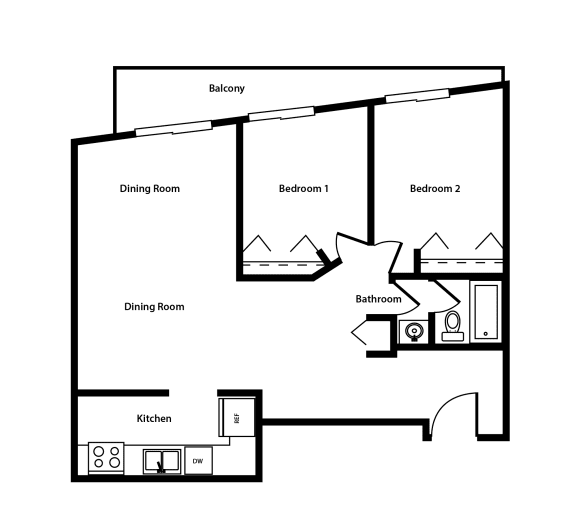
Image resolution: width=576 pixels, height=518 pixels. Identify the location of door. (442, 242).